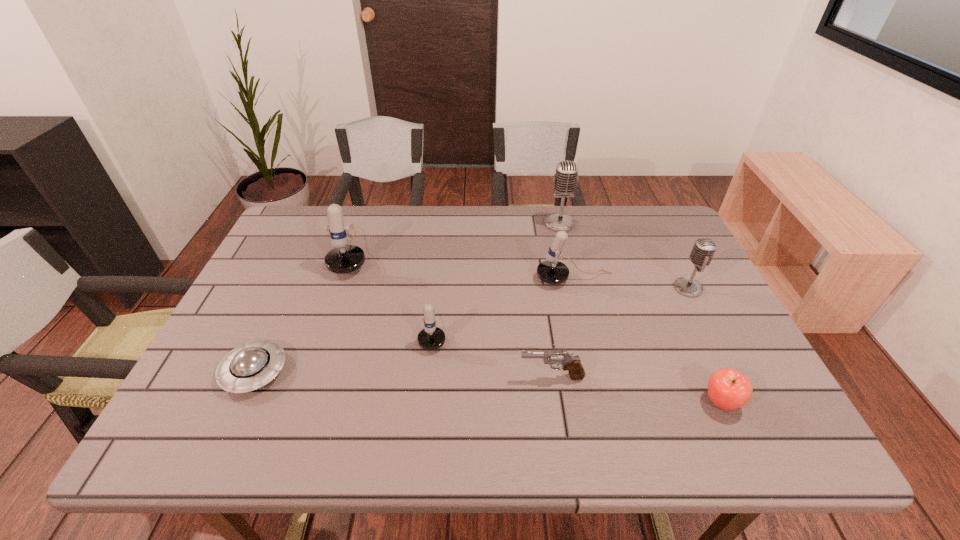
Find the location of a particular element. The width and height of the screenshot is (960, 540). pistol is located at coordinates (573, 364).

At what (x,y) coordinates should I click in order to perform the action: click on the shortest object. Please return your answer as a coordinate pair (x, y). This screenshot has height=540, width=960. Looking at the image, I should click on click(x=252, y=365).

Find the location of a particular element. The height and width of the screenshot is (540, 960). gray saucer is located at coordinates (252, 365).

Locate an element on the screen. vacant space located 0.220m on the front of the left gray microphone is located at coordinates (572, 280).

Identify the location of vacant space located 0.190m on the front of the leftmost white microphone. Image resolution: width=960 pixels, height=540 pixels. (325, 334).

Where is `free space located 0.400m on the front of the rightmost white microphone`? This screenshot has width=960, height=540. free space located 0.400m on the front of the rightmost white microphone is located at coordinates (610, 427).

Where is `vacant space located on the back of the right gray microphone`? The width and height of the screenshot is (960, 540). vacant space located on the back of the right gray microphone is located at coordinates (659, 230).

You are a GUI agent. You are given a task and a screenshot of the screen. Output one action in this format:
    pyautogui.click(x=<x>, y=<y>)
    Task: Click on the vacant region located 0.080m on the front of the shortest microphone
    The image size is (960, 540).
    Given the screenshot: What is the action you would take?
    pyautogui.click(x=428, y=384)

The image size is (960, 540). I want to click on vacant space located on the left of the pink apple, so click(650, 402).

Identify the location of vacant region located 0.290m at the barrel of the gray pistol. (x=389, y=377).